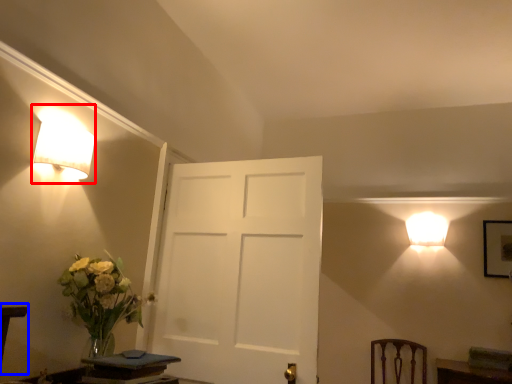
Question: Which object appears closest to the camera in this image, lamp (highlighted by a red box) or table (highlighted by a blue box)?

Choices:
 (A) lamp
 (B) table

Answer: (B)